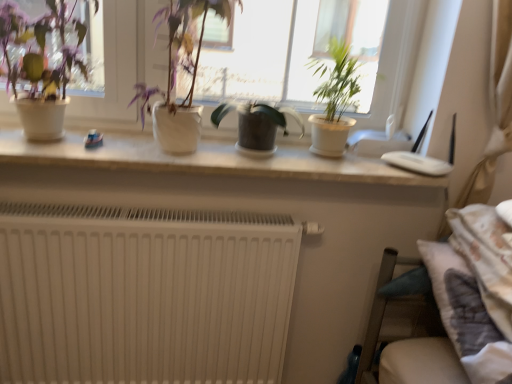
Question: In terms of height, does green matte plant at upper right, positioned as the first houseplant in right-to-left order, look taller or shorter compared to white matte radiator at lower left?

Choices:
 (A) short
 (B) tall

Answer: (A)

Question: From the image's perspective, is green matte plant at upper right, positioned as the fourth houseplant in left-to-right order, above or below white matte radiator at lower left?

Choices:
 (A) below
 (B) above

Answer: (B)

Question: Estimate the real-world distances between objects in this image. Which object is farther from the matte white pot at upper left, the 1th houseplant from the left?

Choices:
 (A) white matte radiator at lower left
 (B) matte white pot at center, which is counted as the 2th houseplant, starting from the left
 (C) green matte plant at upper right, positioned as the first houseplant in right-to-left order
 (D) green matte plant at center, which is counted as the second houseplant, starting from the right

Answer: (C)

Question: Estimate the real-world distances between objects in this image. Which object is closer to the white matte radiator at lower left?

Choices:
 (A) matte white pot at upper left, marked as the 4th houseplant in a right-to-left arrangement
 (B) matte white pot at center, which is counted as the 2th houseplant, starting from the left
 (C) green matte plant at center, the 3th houseplant viewed from the left
 (D) green matte plant at upper right, positioned as the first houseplant in right-to-left order

Answer: (B)